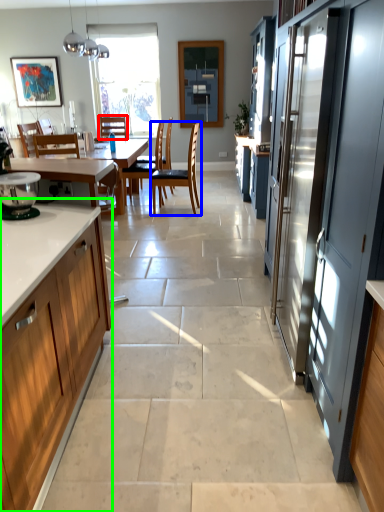
Question: Considering the real-world distances, which object is farthest from chair (highlighted by a red box)? chair (highlighted by a blue box) or cabinetry (highlighted by a green box)?

Choices:
 (A) chair
 (B) cabinetry

Answer: (B)